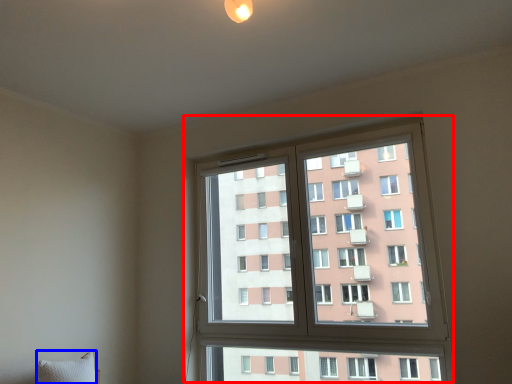
Question: Which of the following is the farthest to the observer, window (highlighted by a red box) or pillow (highlighted by a blue box)?

Choices:
 (A) window
 (B) pillow

Answer: (A)